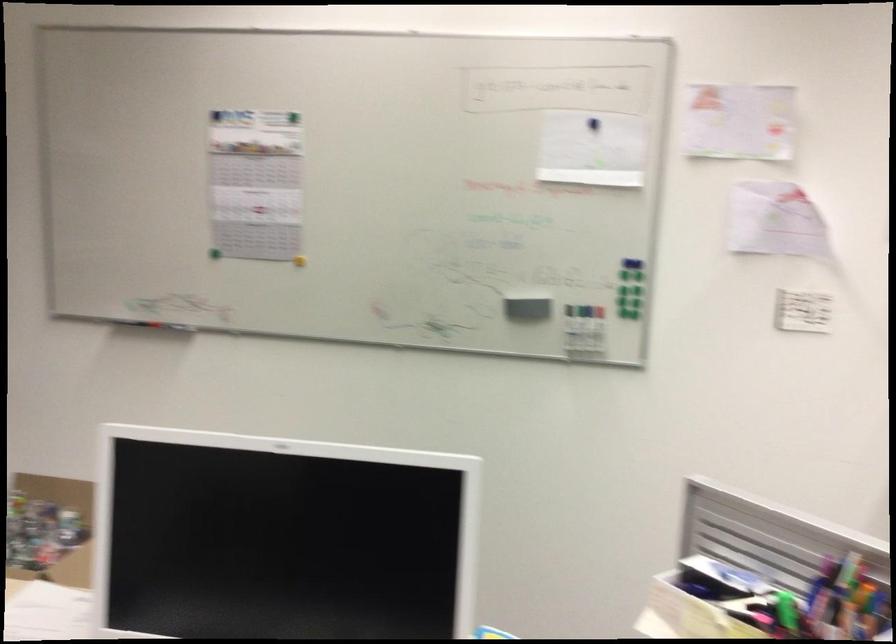
The width and height of the screenshot is (896, 644). I want to click on blue push-pin magnet, so click(216, 116).